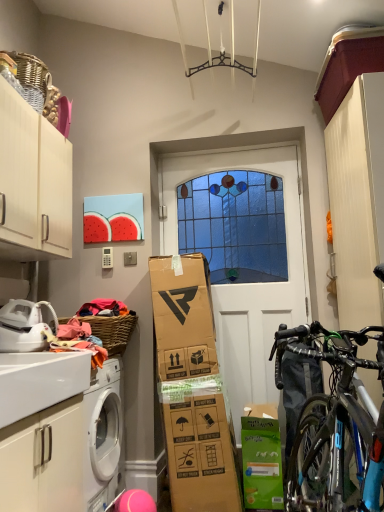
Question: Is woven brown basket at upper left positioned behind white matte door at center?

Choices:
 (A) no
 (B) yes

Answer: (A)

Question: Can you confirm if woven brown basket at upper left is thinner than white matte door at center?

Choices:
 (A) no
 (B) yes

Answer: (A)

Question: From the image's perspective, is woven brown basket at upper left located beneath white matte door at center?

Choices:
 (A) yes
 (B) no

Answer: (A)

Question: Would you say woven brown basket at upper left is a long distance from white matte door at center?

Choices:
 (A) no
 (B) yes

Answer: (A)

Question: Are woven brown basket at upper left and white matte door at center beside each other?

Choices:
 (A) no
 (B) yes

Answer: (A)

Question: Which is correct: white matte door at center is inside woven brown basket at upper left, or outside of it?

Choices:
 (A) outside
 (B) inside

Answer: (A)

Question: Considering the relative positions of white matte door at center and woven brown basket at upper left in the image provided, is white matte door at center to the left or to the right of woven brown basket at upper left?

Choices:
 (A) right
 (B) left

Answer: (A)

Question: Is white matte door at center bigger or smaller than woven brown basket at upper left?

Choices:
 (A) small
 (B) big

Answer: (B)

Question: Does point (220, 335) appear closer or farther from the camera than point (122, 335)?

Choices:
 (A) closer
 (B) farther

Answer: (B)

Question: Choose the correct answer: Is white matte door at center inside green matte cardboard box at lower center or outside it?

Choices:
 (A) inside
 (B) outside

Answer: (B)

Question: Considering the positions of white matte door at center and green matte cardboard box at lower center in the image, is white matte door at center wider or thinner than green matte cardboard box at lower center?

Choices:
 (A) wide
 (B) thin

Answer: (B)

Question: From the image's perspective, relative to green matte cardboard box at lower center, is white matte door at center above or below?

Choices:
 (A) below
 (B) above

Answer: (B)

Question: Considering the positions of point (x=193, y=177) and point (x=251, y=416), is point (x=193, y=177) closer or farther from the camera than point (x=251, y=416)?

Choices:
 (A) farther
 (B) closer

Answer: (A)

Question: Is point pyautogui.click(x=46, y=425) positioned closer to the camera than point pyautogui.click(x=230, y=332)?

Choices:
 (A) farther
 (B) closer

Answer: (B)

Question: From the image's perspective, is white matte cabinet at lower left, arranged as the first cabinetry when ordered from the bottom, positioned above or below white matte door at center?

Choices:
 (A) above
 (B) below

Answer: (B)